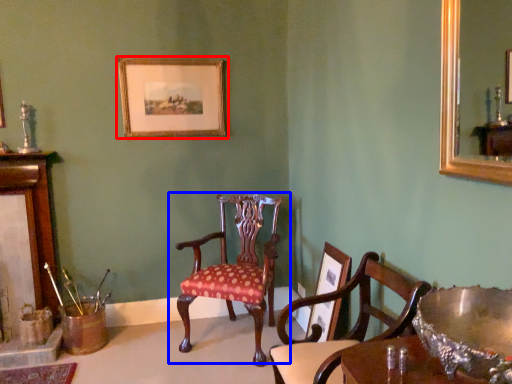
Question: Among these objects, which one is nearest to the camera, picture frame (highlighted by a red box) or chair (highlighted by a blue box)?

Choices:
 (A) picture frame
 (B) chair

Answer: (B)